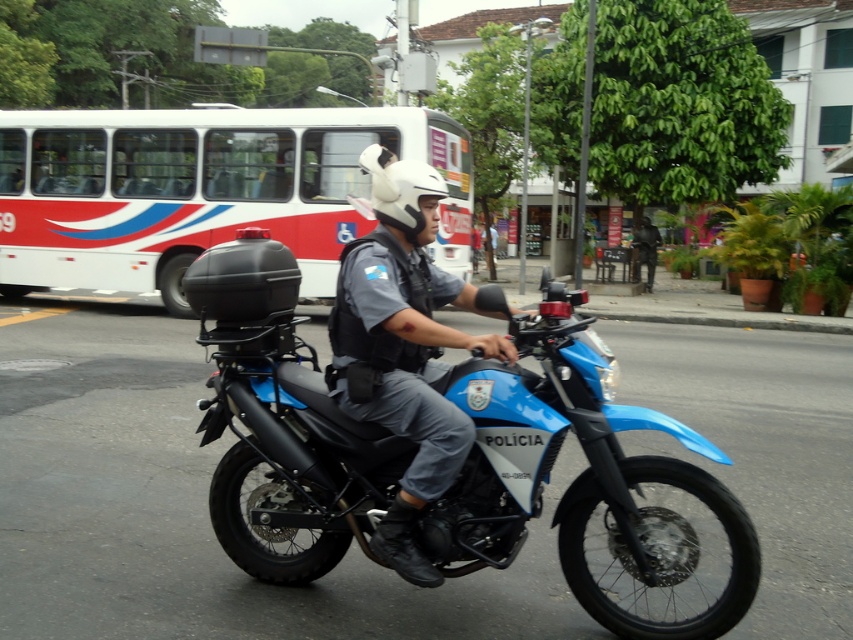
Question: Which point is farther to the camera?

Choices:
 (A) white/red/striped bus at upper left
 (B) white matte helmet at center
 (C) matte black helmet at center
 (D) blue matte/synthetic motorcycle at center

Answer: (A)

Question: Which point appears closest to the camera in this image?

Choices:
 (A) (164, 266)
 (B) (409, 192)
 (C) (409, 490)

Answer: (C)

Question: Does blue matte/synthetic motorcycle at center have a greater width compared to white matte helmet at center?

Choices:
 (A) yes
 (B) no

Answer: (A)

Question: Is blue matte/synthetic motorcycle at center wider than white matte helmet at center?

Choices:
 (A) yes
 (B) no

Answer: (A)

Question: Among these objects, which one is farthest from the camera?

Choices:
 (A) blue matte/synthetic motorcycle at center
 (B) white/red/striped bus at upper left

Answer: (B)

Question: Can you confirm if blue matte/synthetic motorcycle at center is positioned to the right of matte black helmet at center?

Choices:
 (A) yes
 (B) no

Answer: (A)